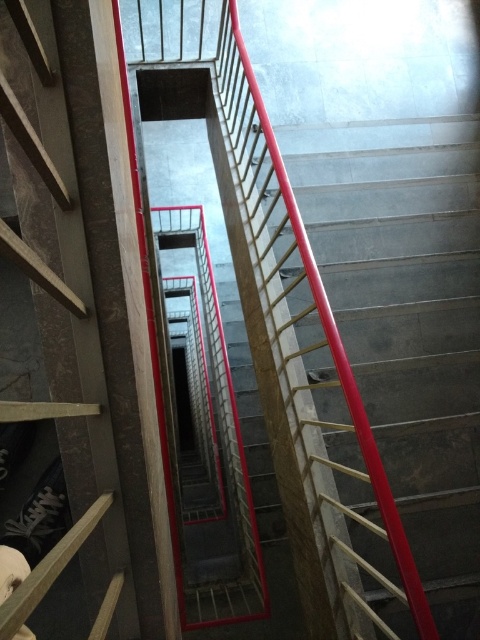
You are standing at the top of the staircase and need to descend to the lower level. You see a metallic silver ladder at center and a metallic red handrail at center. Which object should you grab to safely descend the staircase?

You should grab the metallic red handrail at center because it is part of the staircase structure, while the metallic silver ladder at center is positioned to the left of it and may not be the intended path for descending.

You are standing on the landing of the staircase and want to climb down to the lower floor. You see a metallic silver ladder at center and a metallic red handrail at center. Which object is closer to you that you can grab first?

The metallic silver ladder at center is closer to the viewer than the metallic red handrail at center, so you can grab the metallic silver ladder at center first.

You are standing at the top of the staircase and see a point marked at coordinates (60, 317). What object is located at that point?

The point at coordinates (60, 317) indicates a metallic silver ladder at center.